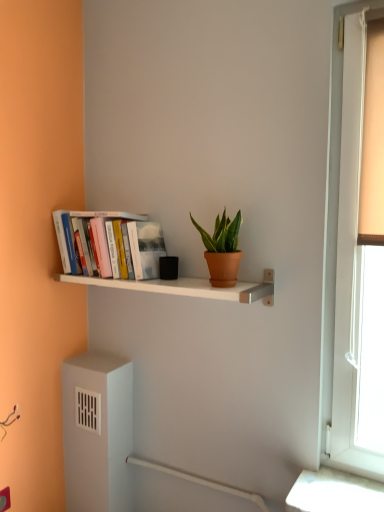
Question: Can you confirm if white matte shelf at center is smaller than hardcover books at left?

Choices:
 (A) yes
 (B) no

Answer: (A)

Question: Can you confirm if white matte shelf at center is positioned to the right of hardcover books at left?

Choices:
 (A) no
 (B) yes

Answer: (B)

Question: Can you confirm if white matte shelf at center is thinner than hardcover books at left?

Choices:
 (A) no
 (B) yes

Answer: (A)

Question: Is hardcover books at left located within white matte shelf at center?

Choices:
 (A) yes
 (B) no

Answer: (B)

Question: From the image's perspective, is white matte shelf at center below hardcover books at left?

Choices:
 (A) yes
 (B) no

Answer: (A)

Question: Is white matte shelf at center positioned with its back to hardcover books at left?

Choices:
 (A) no
 (B) yes

Answer: (A)

Question: Does terracotta clay pot at center have a greater height compared to white matte shelf at center?

Choices:
 (A) yes
 (B) no

Answer: (A)

Question: From the image's perspective, does terracotta clay pot at center appear lower than white matte shelf at center?

Choices:
 (A) no
 (B) yes

Answer: (A)

Question: Is terracotta clay pot at center to the left of white matte shelf at center from the viewer's perspective?

Choices:
 (A) no
 (B) yes

Answer: (A)

Question: From a real-world perspective, is terracotta clay pot at center physically below white matte shelf at center?

Choices:
 (A) no
 (B) yes

Answer: (A)

Question: Is terracotta clay pot at center next to white matte shelf at center?

Choices:
 (A) no
 (B) yes

Answer: (A)

Question: Does terracotta clay pot at center have a lesser height compared to white matte shelf at center?

Choices:
 (A) yes
 (B) no

Answer: (B)

Question: Could hardcover books at left be considered to be inside terracotta clay pot at center?

Choices:
 (A) no
 (B) yes

Answer: (A)